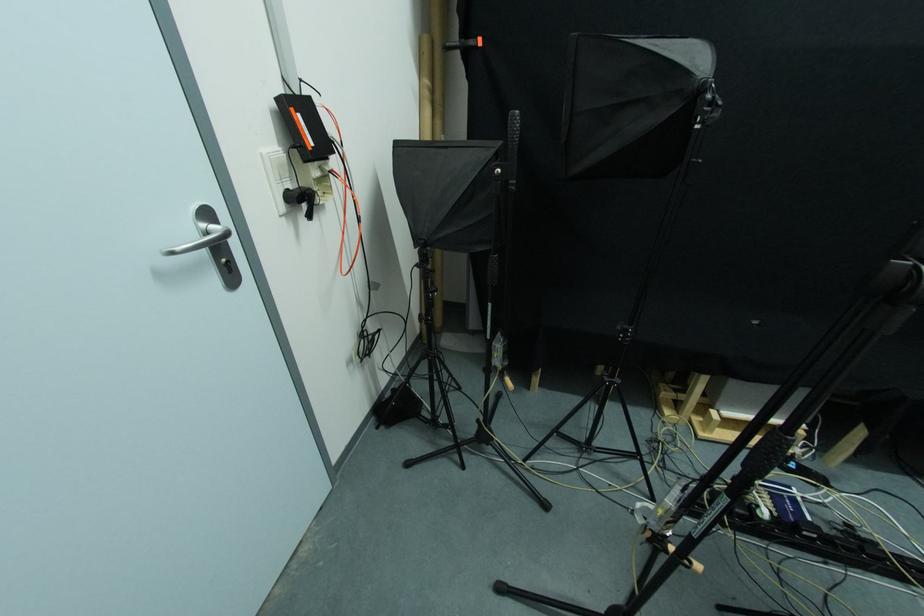
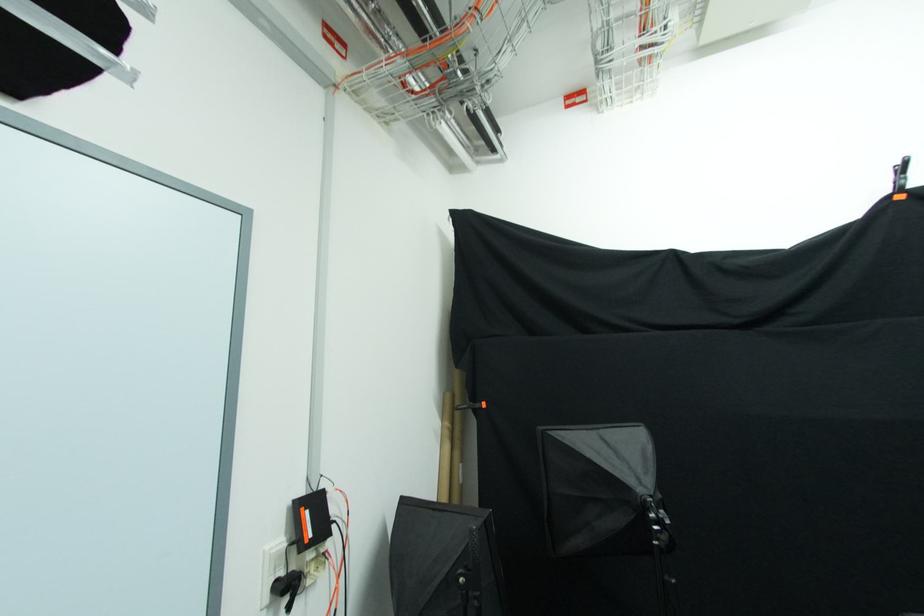
Locate, in the second image, the point that corresponds to the point at 292,188 in the first image.

(285, 577)